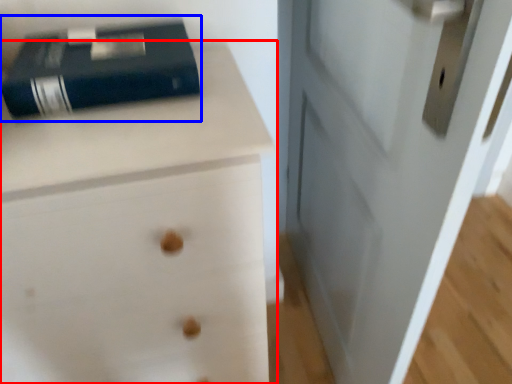
Question: Which point is further to the camera, chest of drawers (highlighted by a red box) or paperback book (highlighted by a blue box)?

Choices:
 (A) chest of drawers
 (B) paperback book

Answer: (B)